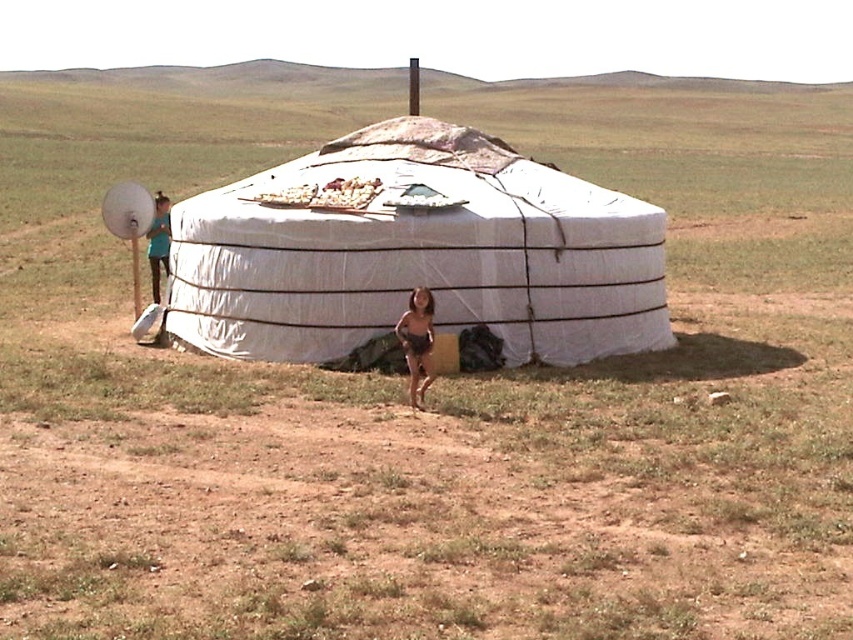
Can you confirm if brown fabric shorts at center is wider than teal fabric shirt at left?

Incorrect, brown fabric shorts at center's width does not surpass teal fabric shirt at left's.

Is brown fabric shorts at center taller than teal fabric shirt at left?

No, brown fabric shorts at center is not taller than teal fabric shirt at left.

Is point (407, 364) in front of point (155, 296)?

Yes, point (407, 364) is closer to viewer.

You are a GUI agent. You are given a task and a screenshot of the screen. Output one action in this format:
    pyautogui.click(x=<x>, y=<y>)
    Task: Click on the brown fabric shorts at center
    This screenshot has height=640, width=853.
    Given the screenshot: What is the action you would take?
    pyautogui.click(x=416, y=340)

Which is more to the right, white crumbly food at center or teal fabric shirt at left?

white crumbly food at center

Who is shorter, white crumbly food at center or teal fabric shirt at left?

white crumbly food at center

The height and width of the screenshot is (640, 853). Identify the location of white crumbly food at center. (x=325, y=195).

Between white canvas tent at center and teal fabric shirt at left, which one appears on the right side from the viewer's perspective?

From the viewer's perspective, white canvas tent at center appears more on the right side.

Is white canvas tent at center closer to the viewer compared to teal fabric shirt at left?

That is True.

Which is behind, point (410, 134) or point (155, 224)?

The point (155, 224) is behind.

Locate an element on the screen. This screenshot has height=640, width=853. white canvas tent at center is located at coordinates (419, 253).